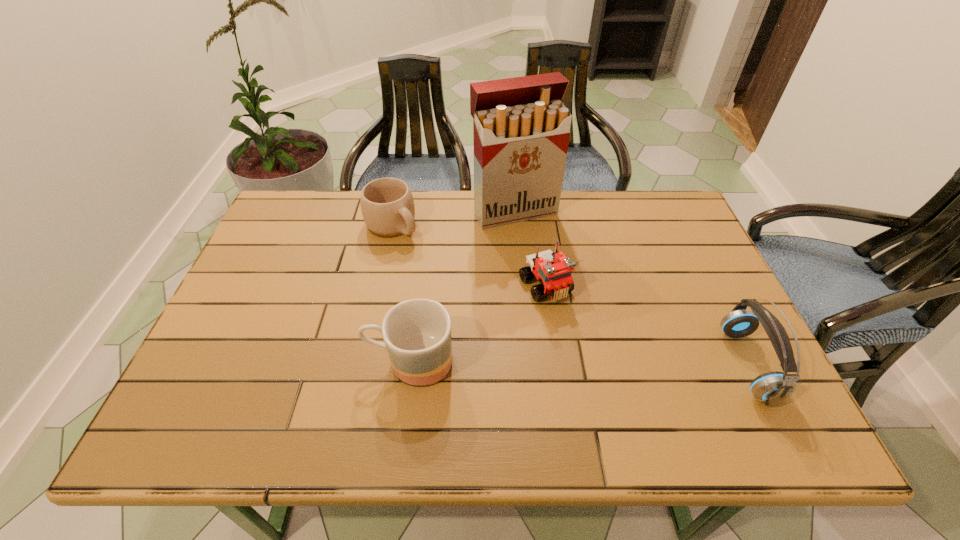
At what (x,y) coordinates should I click in order to perform the action: click on the nearer mug. Please return your answer as a coordinate pair (x, y). This screenshot has height=540, width=960. Looking at the image, I should click on (417, 333).

Identify the location of headset. The image size is (960, 540). (773, 387).

At what (x,y) coordinates should I click in order to perform the action: click on the farther mug. Please return your answer as a coordinate pair (x, y). The width and height of the screenshot is (960, 540). Looking at the image, I should click on (387, 205).

Locate an element on the screen. The width and height of the screenshot is (960, 540). the third farthest object is located at coordinates (553, 270).

Locate an element on the screen. The height and width of the screenshot is (540, 960). cigarette case is located at coordinates (521, 129).

Locate an element on the screen. The image size is (960, 540). free space located on the side with the handle of the nearer mug is located at coordinates (208, 361).

The height and width of the screenshot is (540, 960). In order to click on vacant area situated on the side with the handle of the nearer mug in this screenshot , I will do `click(230, 361)`.

At what (x,y) coordinates should I click in order to perform the action: click on blank area located 0.190m on the side with the handle of the nearer mug. Please return your answer as a coordinate pair (x, y). Looking at the image, I should click on (283, 361).

Locate an element on the screen. vacant region located on the ear cups of the headset is located at coordinates (689, 364).

This screenshot has width=960, height=540. In order to click on vacant space situated on the ear cups of the headset in this screenshot , I will do `click(552, 364)`.